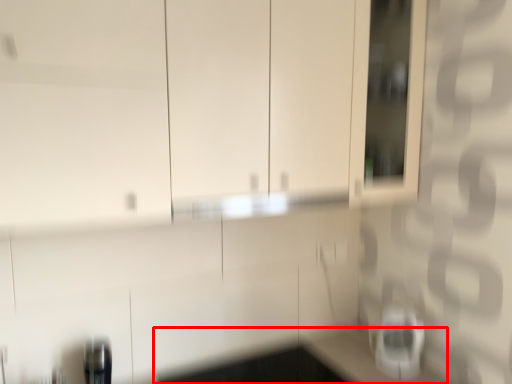
Question: From the image's perspective, what is the correct spatial positioning of counter top (annotated by the red box) in reference to appliance?

Choices:
 (A) above
 (B) below

Answer: (B)